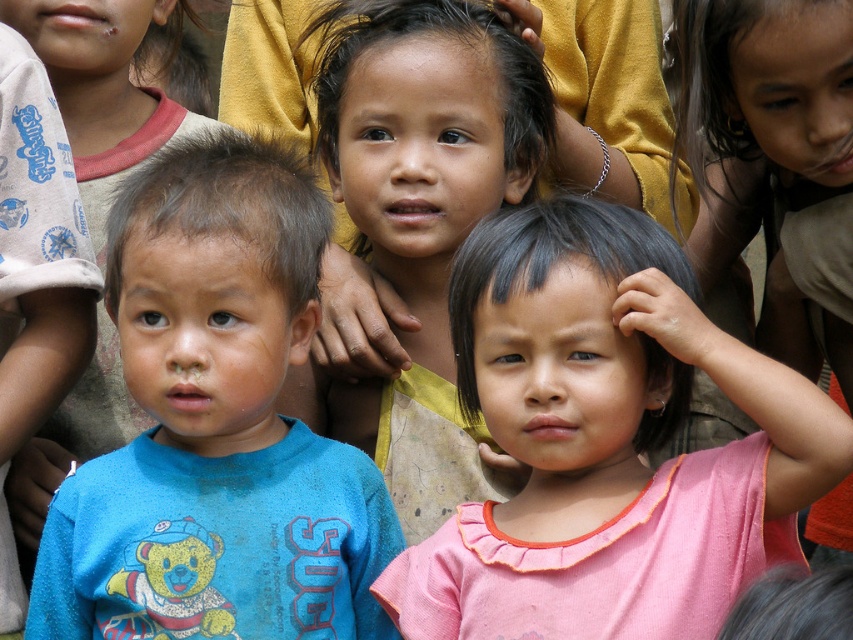
You are a photographer trying to capture a group photo of the children. You notice the pink fabric shirt at center and the matte yellow shirt at center. Which child should you ask to move to the left to ensure both shirts are centered in the frame?

The pink fabric shirt at center is positioned on the right side of the matte yellow shirt at center. To center both shirts, you should ask the child in the pink fabric shirt at center to move to the left so that it aligns with the matte yellow shirt at center.

You are a photographer trying to capture a group shot of the children. You want to ensure that the blue cotton shirt at left and the matte yellow shirt at center are both in the frame. Based on their positions, which child should you position closer to the left side of the camera frame?

The blue cotton shirt at left is to the left of the matte yellow shirt at center, so you should position the child in the blue cotton shirt at left closer to the left side of the camera frame to ensure both are in the frame.

You are a photographer trying to capture the pink fabric shirt at center in the image. The camera is set to focus on the point at coordinates point (604, 442). Will this point be on the pink fabric shirt at center?

Yes, the point (604, 442) indicates the pink fabric shirt at center, so the camera will focus on it.